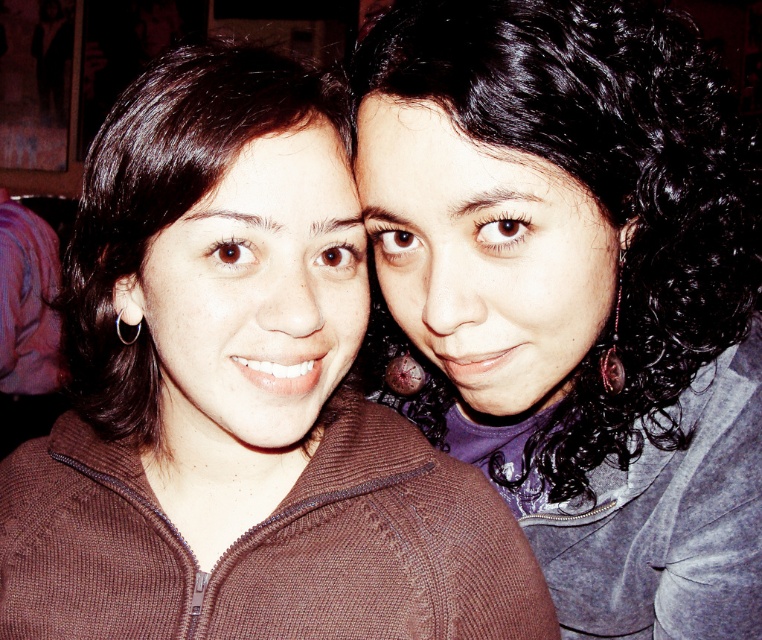
Question: Can you confirm if brown knitted sweater at center is positioned to the right of brown smooth hair at left?

Choices:
 (A) yes
 (B) no

Answer: (A)

Question: Based on their relative distances, which object is nearer to the brown smooth hair at left?

Choices:
 (A) brown knitted sweater at center
 (B) black curly hair at upper right

Answer: (A)

Question: Which object is closer to the camera taking this photo?

Choices:
 (A) black curly hair at upper right
 (B) brown smooth hair at left
 (C) brown knitted sweater at center

Answer: (A)

Question: Does brown knitted sweater at center appear over brown smooth hair at left?

Choices:
 (A) no
 (B) yes

Answer: (A)

Question: Does black curly hair at upper right have a smaller size compared to brown smooth hair at left?

Choices:
 (A) no
 (B) yes

Answer: (A)

Question: Which point is farther to the camera?

Choices:
 (A) (79, 284)
 (B) (562, 120)

Answer: (A)